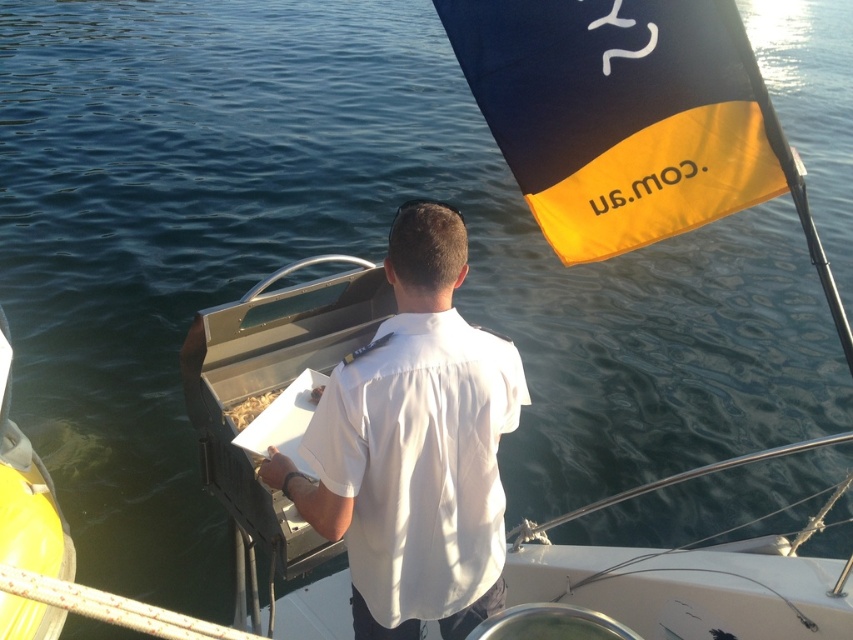
Who is more forward, (x=573, y=262) or (x=392, y=392)?

Point (x=392, y=392)

Is black/yellow fabric flag at upper right positioned before white cotton shirt at center?

That is False.

Is point (532, 96) farther from camera compared to point (287, 470)?

Yes.

I want to click on black/yellow fabric flag at upper right, so click(621, 113).